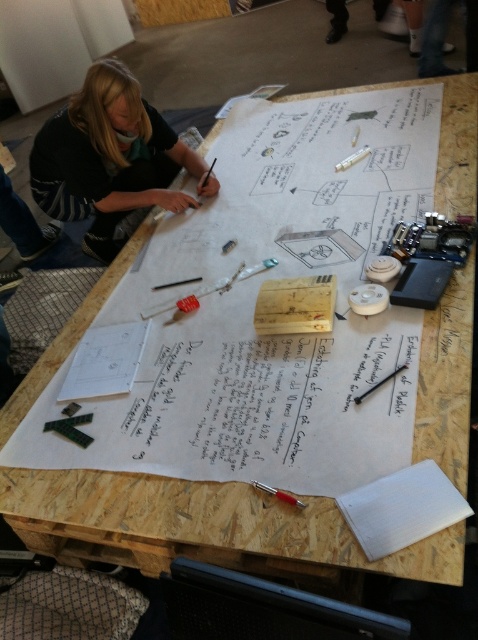
Question: Estimate the real-world distances between objects in this image. Which object is farther from the metallic red pen at lower center?

Choices:
 (A) white paper at lower right
 (B) blonde hair at upper left

Answer: (B)

Question: Which object is the farthest from the blonde hair at upper left?

Choices:
 (A) metallic red pen at lower center
 (B) white paper at lower right

Answer: (B)

Question: Can you confirm if white paper at lower right is positioned above metallic red pen at lower center?

Choices:
 (A) no
 (B) yes

Answer: (B)

Question: Does white paper at lower right appear over metallic red pen at lower center?

Choices:
 (A) yes
 (B) no

Answer: (A)

Question: Does blonde hair at upper left lie in front of white paper at lower right?

Choices:
 (A) no
 (B) yes

Answer: (A)

Question: Estimate the real-world distances between objects in this image. Which object is farther from the blonde hair at upper left?

Choices:
 (A) white paper at lower right
 (B) metallic red pen at lower center

Answer: (A)